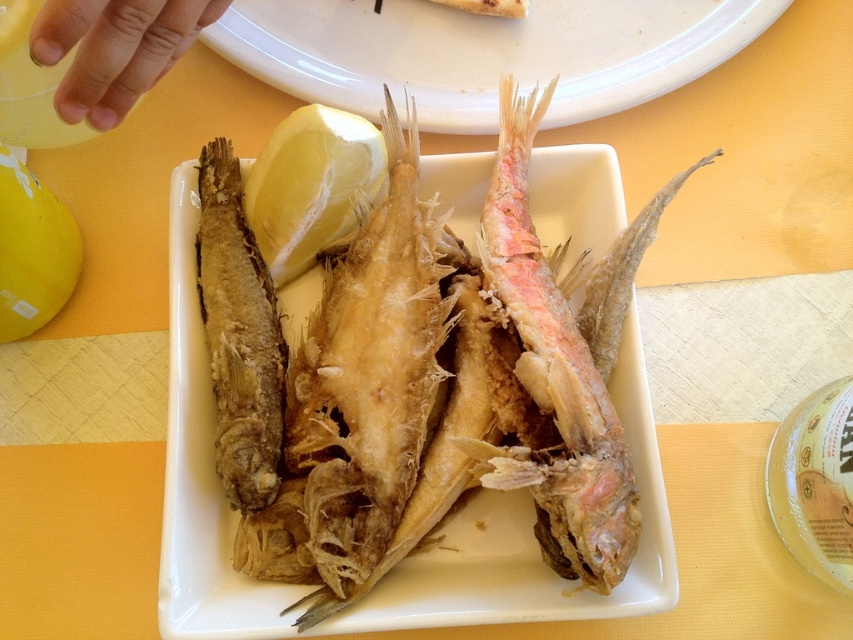
Can you confirm if golden fried fish at center is positioned to the right of golden crispy fish at center?

Correct, you'll find golden fried fish at center to the right of golden crispy fish at center.

Who is lower down, golden fried fish at center or golden crispy fish at center?

Positioned lower is golden fried fish at center.

In order to click on golden fried fish at center in this screenshot , I will do (531, 547).

Can you confirm if fried fish at center is wider than yellow matte lemon at center?

Yes, fried fish at center is wider than yellow matte lemon at center.

Between fried fish at center and yellow matte lemon at center, which one appears on the right side from the viewer's perspective?

fried fish at center

Is point (399, 44) in front of point (339, 209)?

No, it is behind (339, 209).

I want to click on fried fish at center, so (x=485, y=52).

Between fried fish at center and brown crispy fish at left, which one appears on the right side from the viewer's perspective?

Positioned to the right is fried fish at center.

Is fried fish at center shorter than brown crispy fish at left?

Indeed, fried fish at center has a lesser height compared to brown crispy fish at left.

What are the coordinates of `fried fish at center` in the screenshot? It's located at (485, 52).

Where is `fried fish at center`? The height and width of the screenshot is (640, 853). fried fish at center is located at coordinates (485, 52).